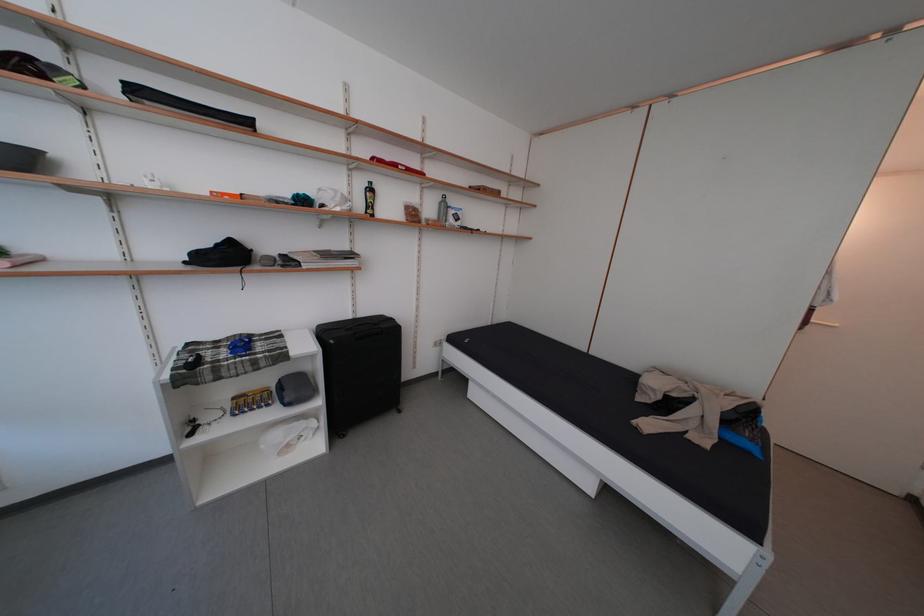
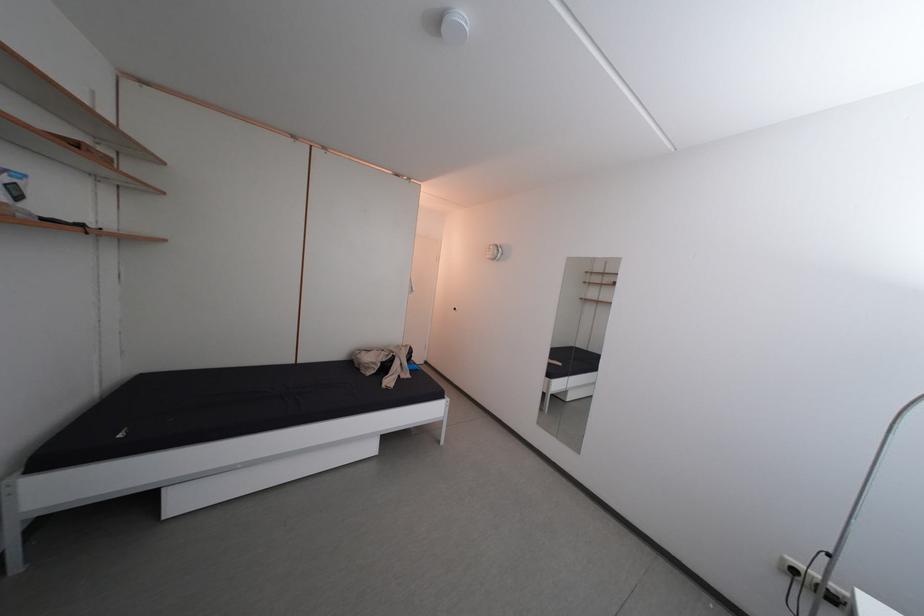
Question: Based on the continuous images, in which direction is the camera rotating? Reply with the corresponding letter.

Choices:
 (A) Left
 (B) Right
 (C) Up
 (D) Down

Answer: (B)